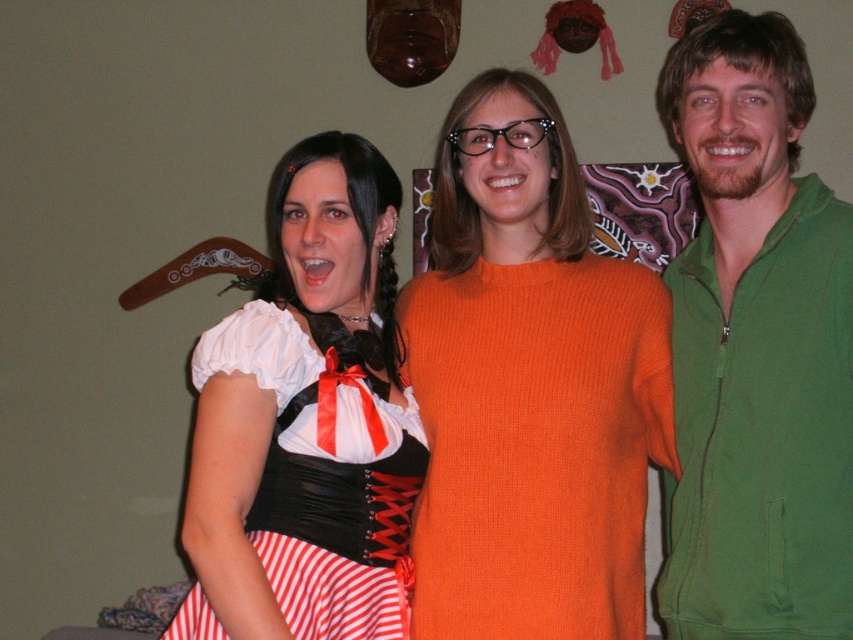
In the scene shown: You are a photographer trying to capture a closeup of the matte black corset at center without the orange knitted sweater at center blocking the view. Is this possible given their positions?

The orange knitted sweater at center is further to the viewer than matte black corset at center, so it is blocking the view. Therefore, it is not possible to capture a closeup of the matte black corset at center without the orange knitted sweater at center blocking the view.